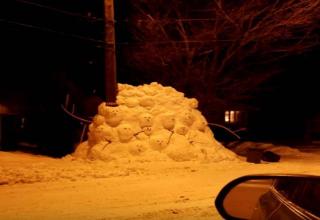
Image resolution: width=320 pixels, height=220 pixels. I want to click on window illuminated from within, so click(x=231, y=118).